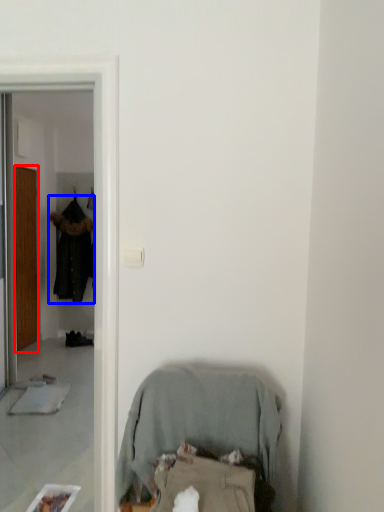
Question: Among these objects, which one is nearest to the camera, door (highlighted by a red box) or clothing (highlighted by a blue box)?

Choices:
 (A) door
 (B) clothing

Answer: (A)